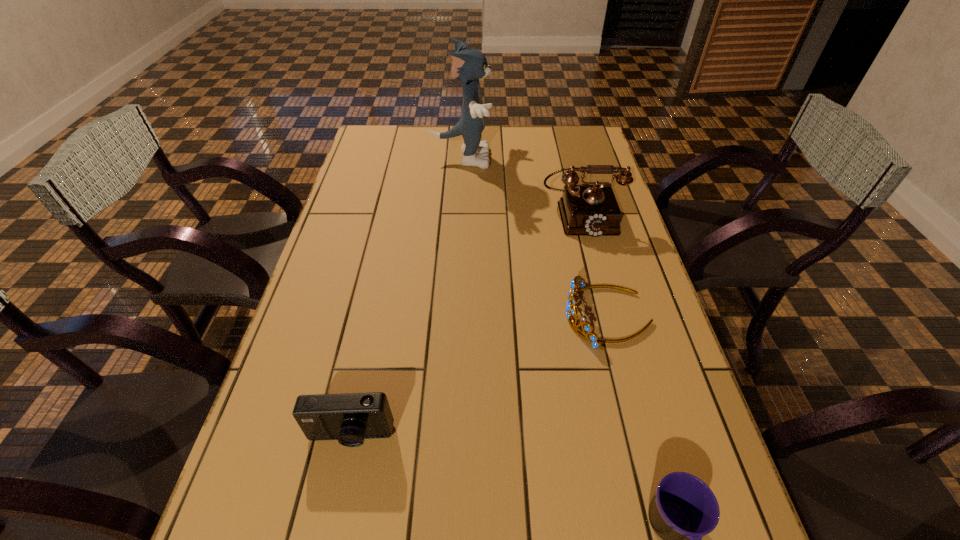
I want to click on the farthest object, so click(470, 65).

Identify the location of the tallest object. (470, 65).

Where is `telephone`? The height and width of the screenshot is (540, 960). telephone is located at coordinates (586, 210).

Find the location of `the second tallest object`. the second tallest object is located at coordinates (586, 210).

Where is `the third nearest object`? the third nearest object is located at coordinates (571, 309).

Image resolution: width=960 pixels, height=540 pixels. What are the coordinates of `the fourth farthest object` in the screenshot? It's located at (350, 418).

Locate an element on the screen. This screenshot has width=960, height=540. vacant space positioned on the front-facing side of the tallest object is located at coordinates (541, 158).

What are the coordinates of `vacant space located 0.250m on the dial of the telephone` in the screenshot? It's located at (604, 303).

Locate an element on the screen. The image size is (960, 540). free space located 0.190m on the front-facing side of the tiara is located at coordinates (490, 316).

Locate an element on the screen. Image resolution: width=960 pixels, height=540 pixels. free location located 0.190m on the front-facing side of the tiara is located at coordinates (490, 316).